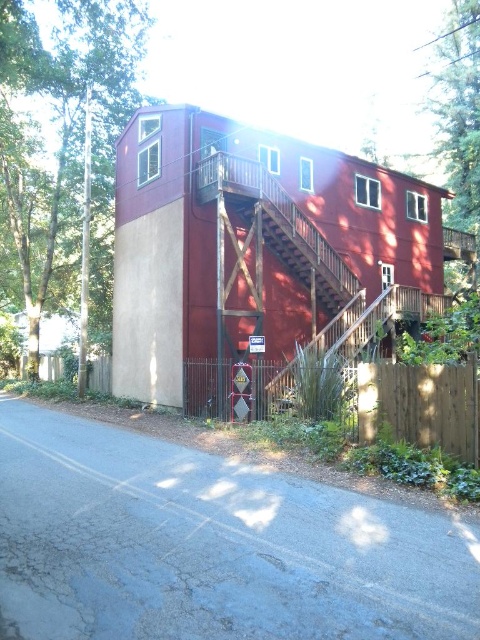
Consider the image. You are a landscape architect designing a path that needs to pass between the green leafy tree at left and the wooden fence at lower left. Based on their widths, which one might require more space to accommodate?

The green leafy tree at left might be wider than the wooden fence at lower left, so it would require more space to accommodate.

You are a gardener standing at the wooden fence at lower left, and you want to water the green leafy tree at left. If your hose can reach up to 15 meters, will you be able to water the tree without moving the hose?

The distance between the green leafy tree at left and the wooden fence at lower left is 15.86 meters. Since the hose can only reach up to 15 meters, you will not be able to water the tree without moving the hose.

You are standing on the road in front of the house and want to see the green leafy tree at left. Is the wooden fence at lower left blocking your view of the tree?

The green leafy tree at left is above the wooden fence at lower left, so the fence is not blocking your view of the tree.